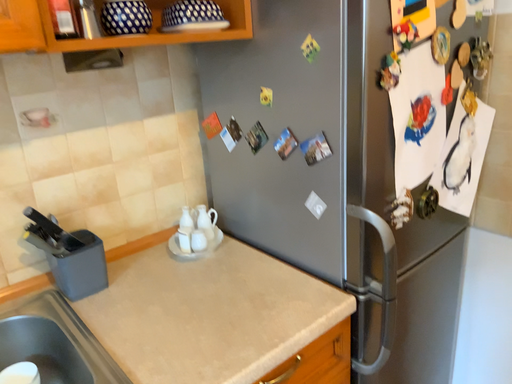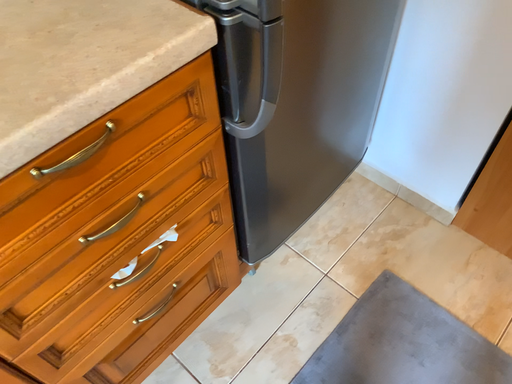
Question: Which way did the camera rotate in the video?

Choices:
 (A) rotated upward
 (B) rotated downward

Answer: (B)